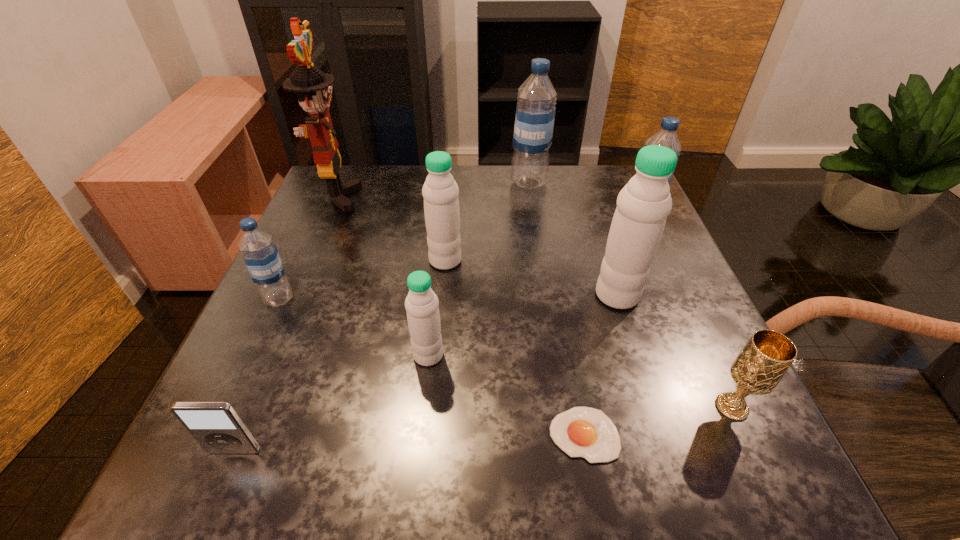
Locate which white water bottle is the third closest to the tallest object. Please provide its 2D coordinates. Your answer should be formatted as a tuple, i.e. [(x, y)], where the tuple contains the x and y coordinates of a point satisfying the conditions above.

[(644, 203)]

The height and width of the screenshot is (540, 960). Find the location of `the second closest white water bottle relative to the iPod`. the second closest white water bottle relative to the iPod is located at coordinates (440, 191).

Identify the location of vacant space that satisfies the following two spatial constraints: 1. on the label of the smallest blue water bottle; 2. on the left side of the nearest white water bottle. (253, 355).

Find the location of a particular element. Image resolution: width=960 pixels, height=540 pixels. free space that satisfies the following two spatial constraints: 1. on the label of the farthest water bottle; 2. on the front-facing side of the ninth tallest object is located at coordinates (570, 451).

This screenshot has width=960, height=540. What are the coordinates of `free space that satisfies the following two spatial constraints: 1. on the front-facing side of the tallest object; 2. on the label of the smallest blue water bottle` in the screenshot? It's located at (295, 299).

This screenshot has width=960, height=540. Identify the location of free space that satisfies the following two spatial constraints: 1. on the front-facing side of the nutcracker; 2. on the back side of the fifth water bottle from left to right. (296, 295).

The image size is (960, 540). I want to click on free space that satisfies the following two spatial constraints: 1. on the front-facing side of the nutcracker; 2. on the right side of the farthest white water bottle, so click(x=311, y=260).

Locate an element on the screen. This screenshot has height=540, width=960. vacant point that satisfies the following two spatial constraints: 1. on the label of the leftmost blue water bottle; 2. on the right side of the third shortest object is located at coordinates (229, 407).

The width and height of the screenshot is (960, 540). Find the location of `free space that satisfies the following two spatial constraints: 1. on the label of the farthest water bottle; 2. on the label of the nearest blue water bottle`. free space that satisfies the following two spatial constraints: 1. on the label of the farthest water bottle; 2. on the label of the nearest blue water bottle is located at coordinates (546, 299).

Identify the location of free location that satisfies the following two spatial constraints: 1. on the front-facing side of the tallest object; 2. on the right side of the second farthest white water bottle. This screenshot has width=960, height=540. (x=296, y=295).